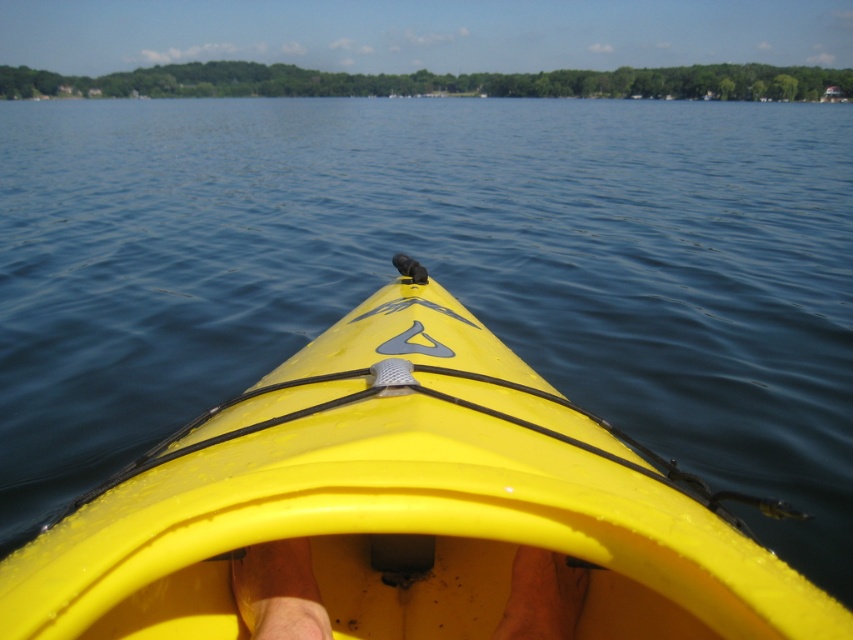
At what (x,y) coordinates should I click in order to perform the action: click on yellow plastic kayak at center. Please return your answer as a coordinate pair (x, y). This screenshot has width=853, height=640. Looking at the image, I should click on (405, 502).

Does point (120, 596) lie behind point (312, 592)?

That is False.

This screenshot has height=640, width=853. What are the coordinates of `yellow plastic kayak at center` in the screenshot? It's located at (405, 502).